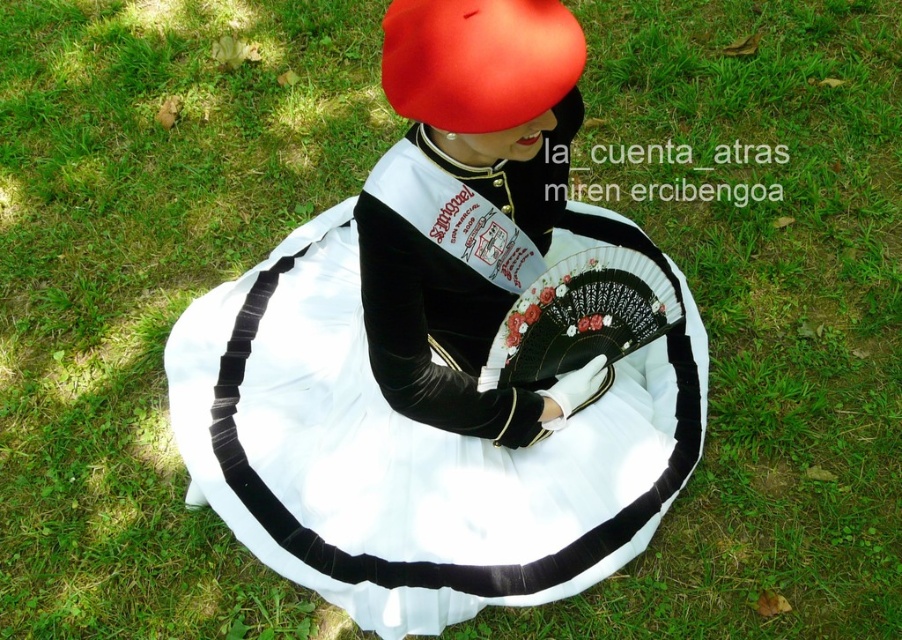
You are organizing a costume party and need to decide which item to store first in a small closet. Given the white satin dress at center and the matte red hat at upper center, which item requires more space?

The white satin dress at center requires more storage space because it is bigger than the matte red hat at upper center.

Based on the scene description, can you determine if the white satin dress at center is wider than the matte red hat at upper center?

The white satin dress at center might be wider than matte red hat at upper center according to the description.